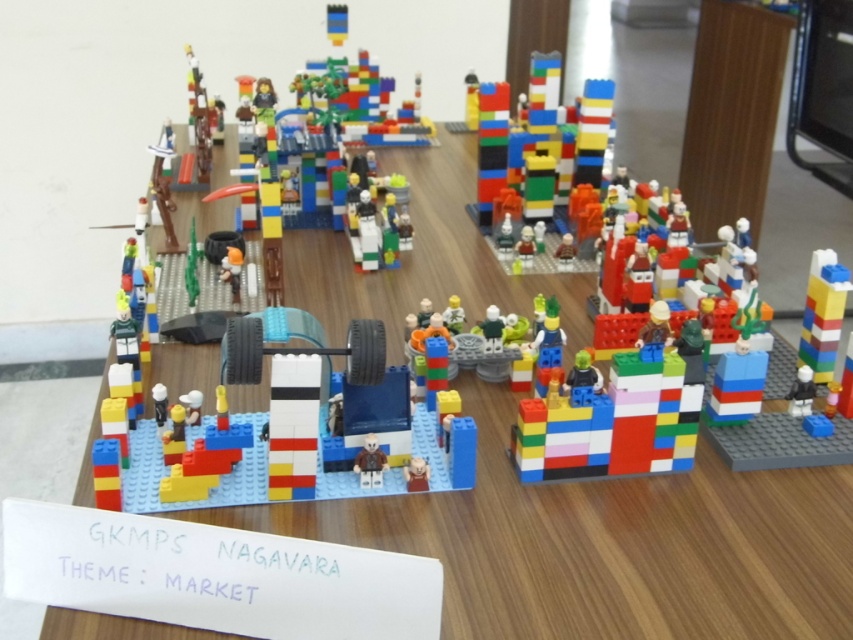
Which is in front, point (172, 506) or point (379, 461)?

Point (172, 506) is in front.

Between smooth blue brick wall at center and matte brown minifigure at center, which one has less height?

matte brown minifigure at center

Which is in front, point (459, 456) or point (363, 481)?

Point (459, 456) is more forward.

The width and height of the screenshot is (853, 640). Find the location of `smooth blue brick wall at center`. smooth blue brick wall at center is located at coordinates (288, 433).